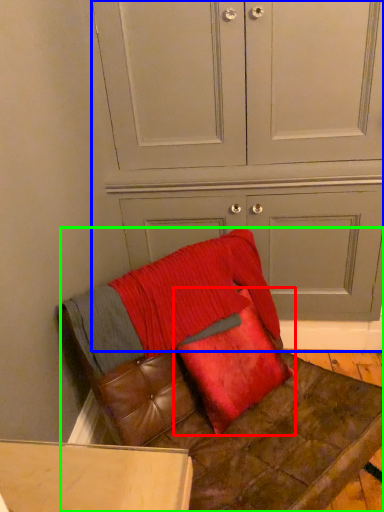
Question: Based on their relative distances, which object is farther from pillow (highlighted by a red box)? Choose from dresser (highlighted by a blue box) and furniture (highlighted by a green box).

Choices:
 (A) dresser
 (B) furniture

Answer: (A)